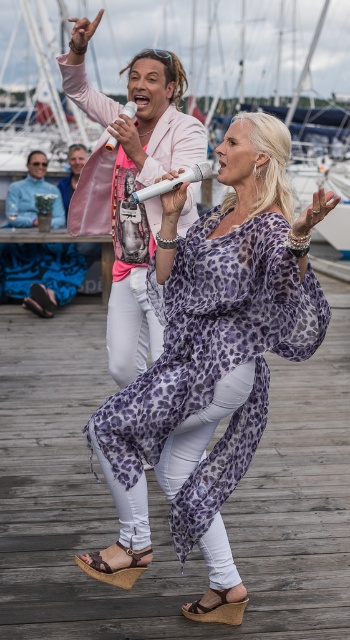
You are a photographer trying to capture the purple leopard print dress at center and the brown suede sandal at lower center in the same frame. Based on their positions, which object should you focus on first to ensure both are in the frame?

The purple leopard print dress at center is located above the brown suede sandal at lower center. To capture both in the same frame, focus on the purple leopard print dress at center first, then adjust the camera angle downward to include the brown suede sandal at lower center.